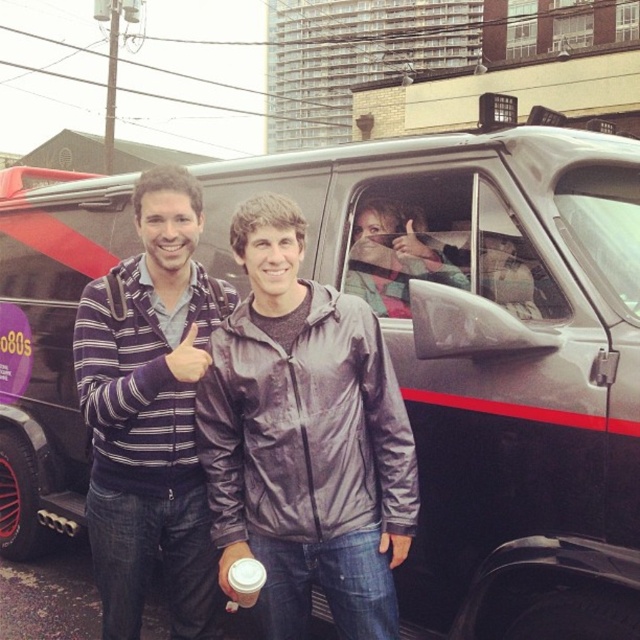
You are designing a poster for a community event and need to ensure that the striped sweater at center and the matte black hand at center are both visible. Given that the poster has a maximum width constraint, which object should you prioritize scaling down to maintain the other object at its original size?

The striped sweater at center is wider than the matte black hand at center, so you should prioritize scaling down the striped sweater at center to maintain the matte black hand at center at its original size.

You are standing at point (x=358, y=296) and want to shake hands with the person on the left. Can you reach them if your arm is 1.2 meters long?

The distance between you and the person on the left is 2.90 meters, which is greater than your arm length of 1.2 meters. You cannot reach them.

You are standing in the urban scene and want to know which of the two points, point (163,348) or point (172,372), is closer to you. Based on their positions, which one would you say is nearer?

Point (172,372) is closer to you because it is in front of point (163,348).